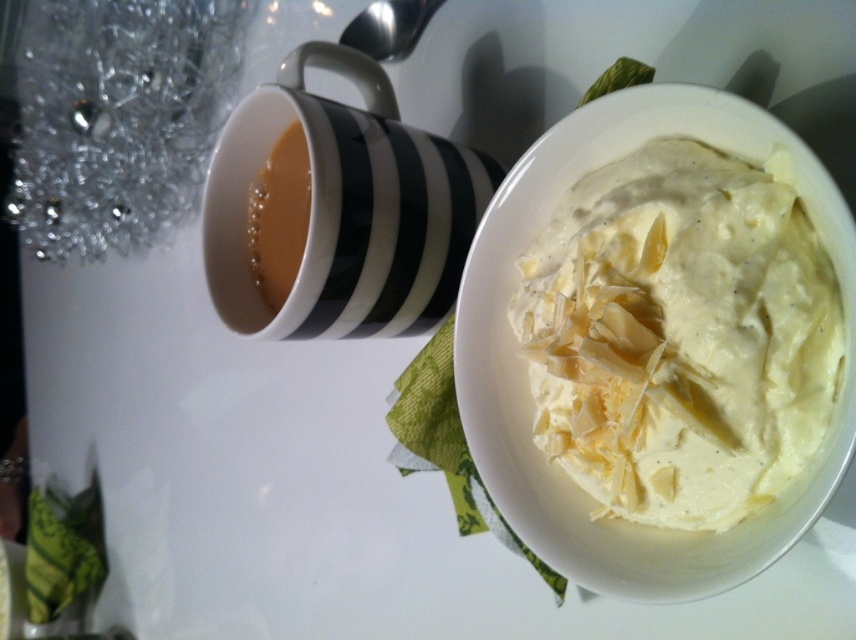
Is the position of white creamy pasta at center less distant than that of brown glossy coffee at upper left?

Yes, it is in front of brown glossy coffee at upper left.

Is point (687, 388) positioned before point (294, 154)?

Yes, it is in front of point (294, 154).

Find the location of `white creamy pasta at center`. white creamy pasta at center is located at coordinates (681, 336).

Does black striped mug at upper left have a greater height compared to brown glossy coffee at upper left?

Yes, black striped mug at upper left is taller than brown glossy coffee at upper left.

Between black striped mug at upper left and brown glossy coffee at upper left, which one appears on the left side from the viewer's perspective?

Positioned to the left is brown glossy coffee at upper left.

Who is more forward, [395,200] or [272,220]?

Point [395,200] is more forward.

Image resolution: width=856 pixels, height=640 pixels. What are the coordinates of `black striped mug at upper left` in the screenshot? It's located at (345, 209).

Can you confirm if white creamy pasta at center is positioned to the right of black striped mug at upper left?

Indeed, white creamy pasta at center is positioned on the right side of black striped mug at upper left.

Does point (528, 304) come behind point (328, 170)?

Yes, it is.

Locate an element on the screen. white creamy pasta at center is located at coordinates (681, 336).